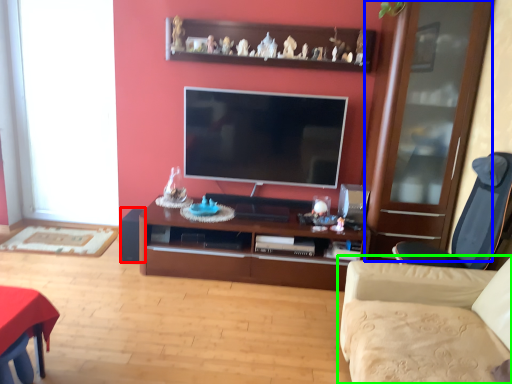
Question: Based on their relative distances, which object is nearer to speaker (highlighted by a red box)? Choose from glass door (highlighted by a blue box) and studio couch (highlighted by a green box).

Choices:
 (A) glass door
 (B) studio couch

Answer: (B)